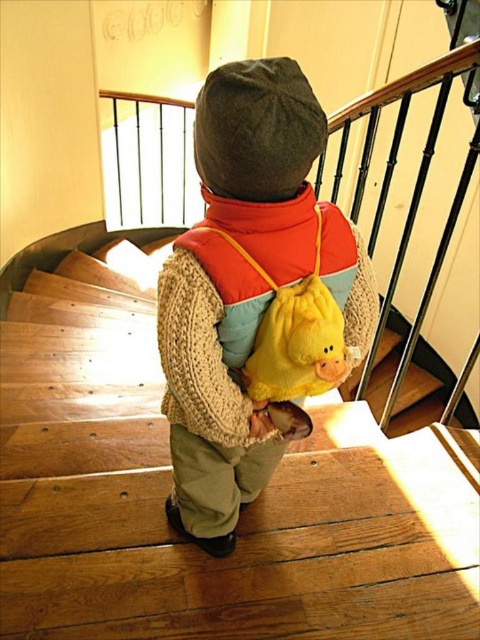
You are a photographer trying to capture the child walking up the stairs. You want to ensure the wooden stairs at center and the knitted wool sweater at center are both visible in the frame. Based on their positions, which object should you focus on first to include both in the shot?

The wooden stairs at center is positioned on the left side of the knitted wool sweater at center. To include both in the frame, focus on the wooden stairs at center first as it is on the left, ensuring the sweater remains in view to the right.

You are a parent trying to ensure your child is safe while climbing the wooden stairs at center. The yellow plush backpack at center is attached to the child. Does the backpack interfere with the child reaching the railing?

The wooden stairs at center is further to the viewer than yellow plush backpack at center, so the backpack is closer to the child and may interfere with their ability to reach the railing.

Where is the knitted wool sweater at center located in the image?

The knitted wool sweater at center is located at the point coordinates of 0.447 in the x axis and 0.487 in the y axis.